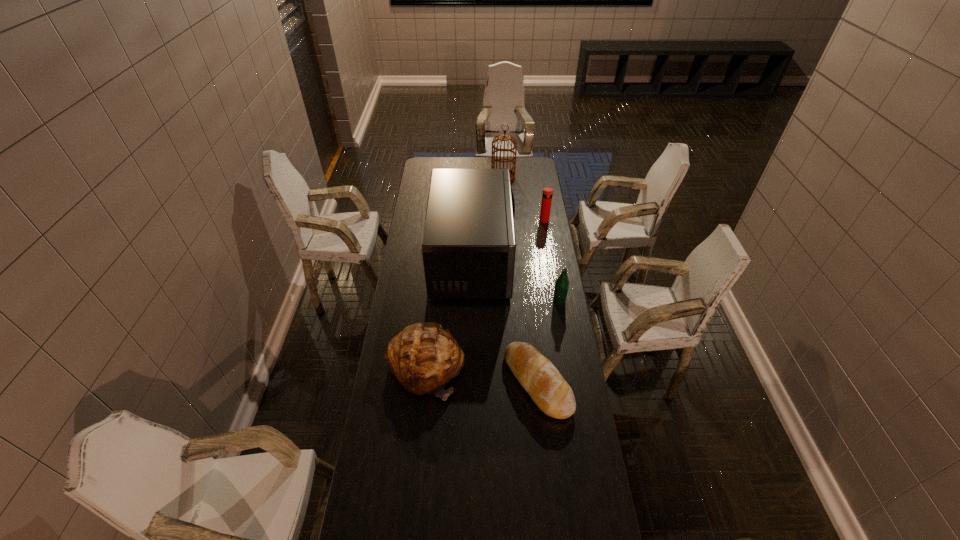
The width and height of the screenshot is (960, 540). I want to click on free space in the image that satisfies the following two spatial constraints: 1. on the back side of the bottle; 2. on the front-facing side of the microwave oven, so click(552, 259).